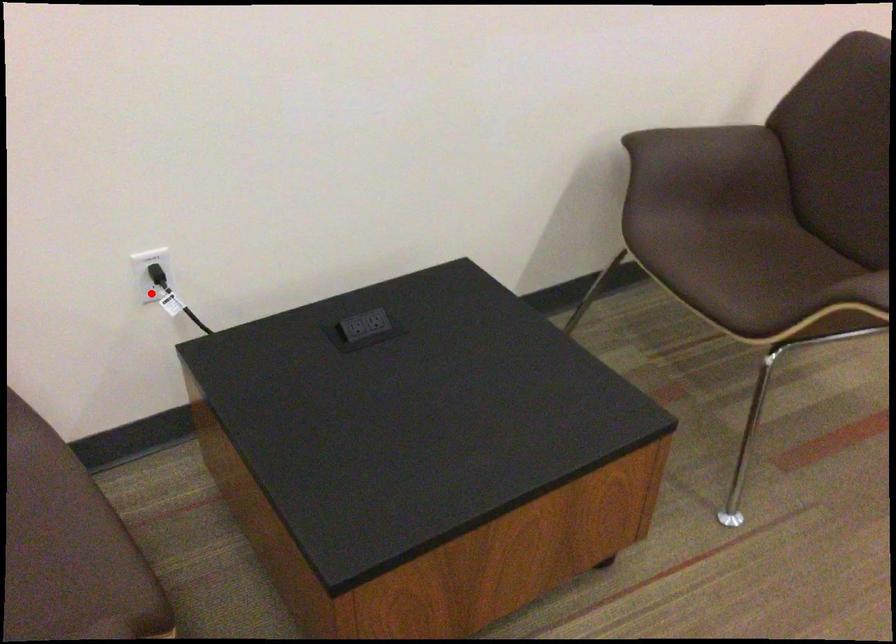
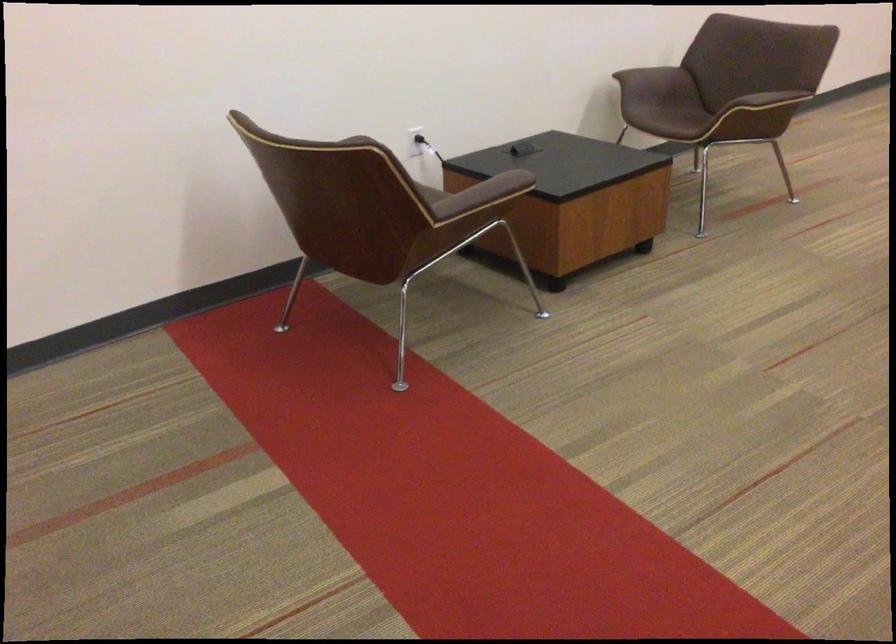
Find the pixel in the second image that matches the highlighted location in the first image.

(417, 140)